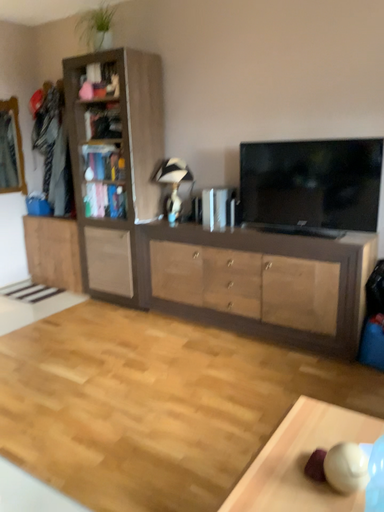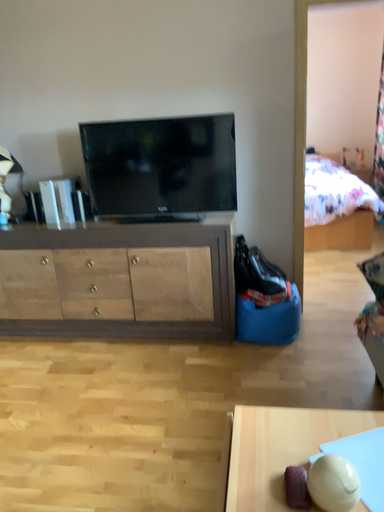
Question: How did the camera likely rotate when shooting the video?

Choices:
 (A) rotated right
 (B) rotated left

Answer: (A)